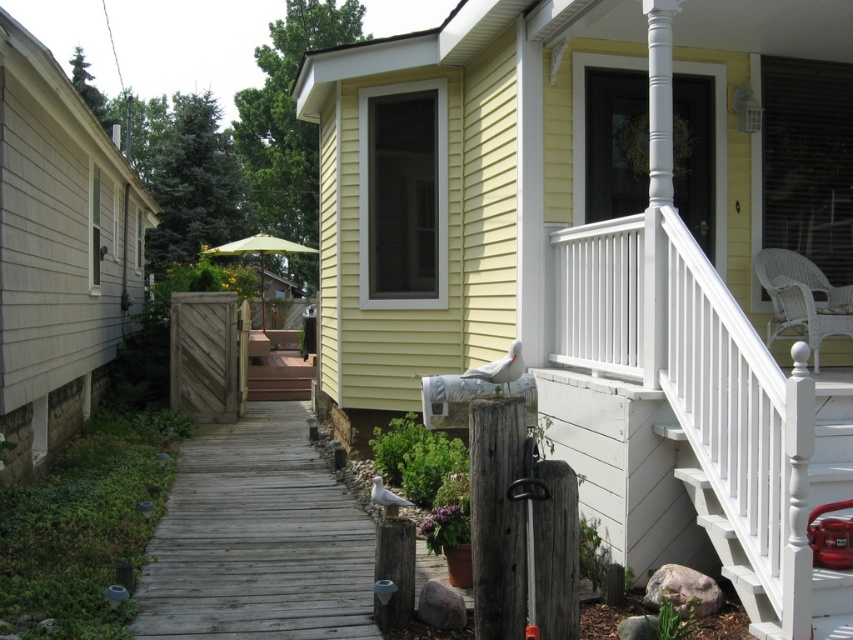
You are standing on the grass near the house and want to walk to the garden bed with purple flowers. The path leads you past the weathered wood deck at center and the weathered wood post at center. Which object will you encounter first?

The weathered wood deck at center is positioned under the weathered wood post at center, so you will encounter the weathered wood deck at center first before reaching the weathered wood post at center.

You are planning to place a new bench in the garden. The bench requires a space larger than the weathered wood post at center. Can the green fabric umbrella at center be moved to make space for the bench?

The weathered wood post at center occupies less space than the green fabric umbrella at center. Therefore, moving the green fabric umbrella at center would free up enough space for the bench since the umbrella takes up more area than the post.

You are standing on the lawn in front of the house and want to walk towards the entrance. Which object, the weathered wood deck at center or the weathered wood post at center, will you encounter first?

You will encounter the weathered wood deck at center first because it is closer to you than the weathered wood post at center.